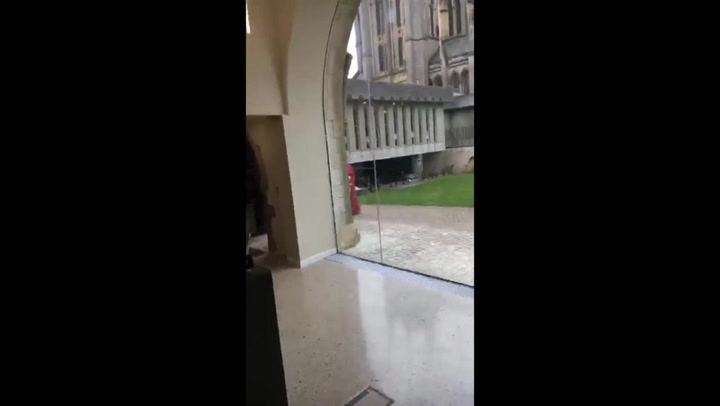
This screenshot has width=720, height=406. I want to click on tile floor, so click(x=384, y=333).